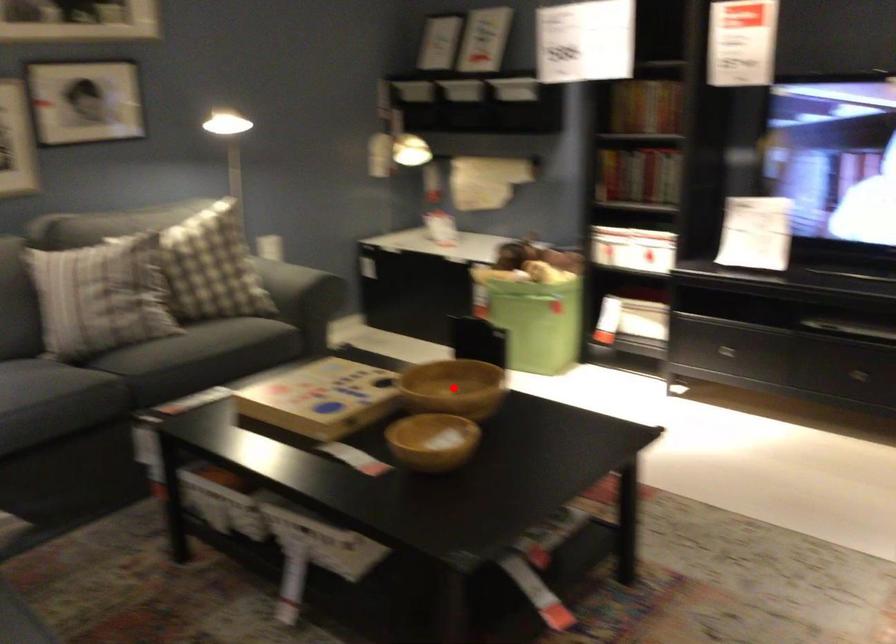
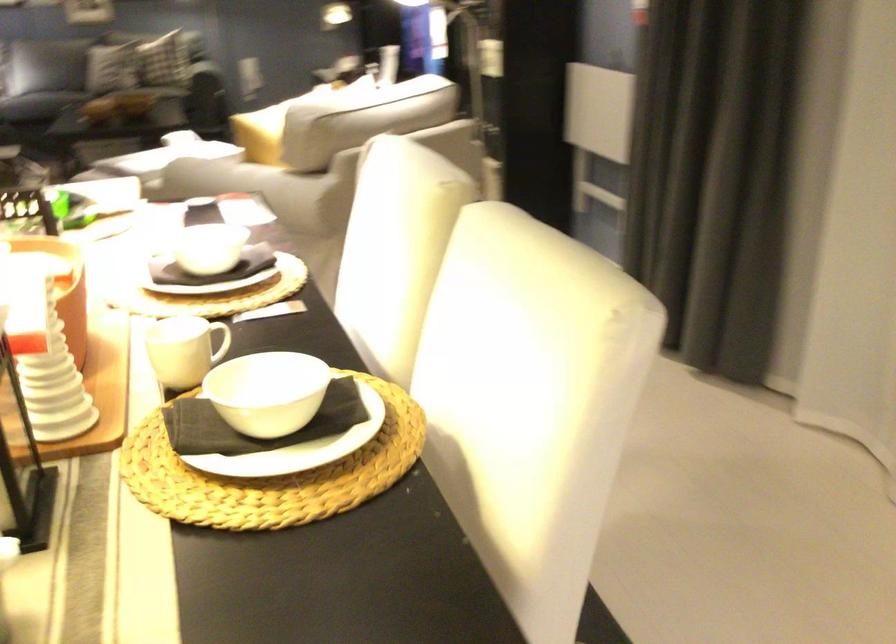
Question: I am providing you with two images of the same scene from different viewpoints. A red point is marked on the first image. Is the red point's position out of view in image 2?

Choices:
 (A) Yes
 (B) No

Answer: (A)